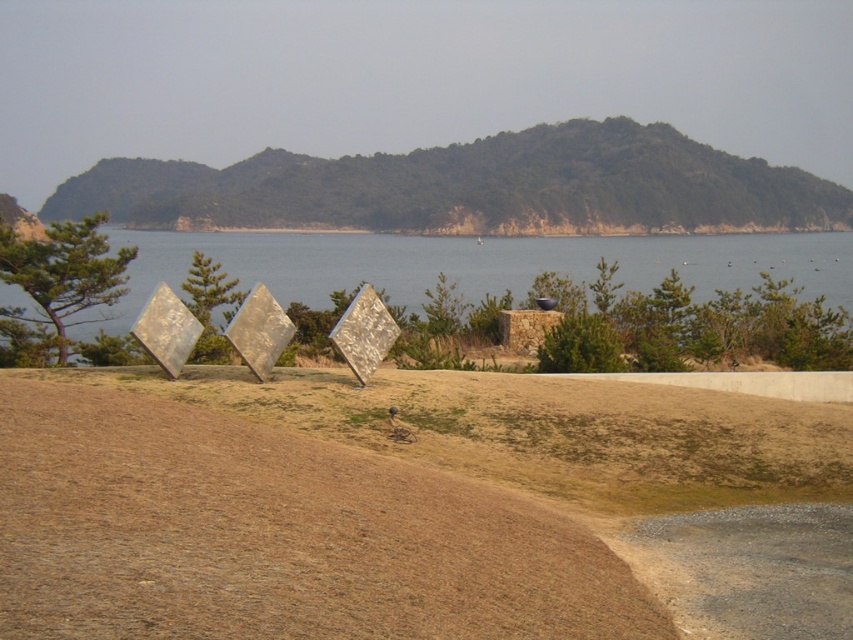
Is point (337, 216) closer to viewer compared to point (310, 276)?

That is False.

How far apart are green textured hillside at upper center and blue water at center?

green textured hillside at upper center is 23.48 meters away from blue water at center.

Which is behind, point (219, 202) or point (341, 237)?

The point (341, 237) is more distant.

Where is `green textured hillside at upper center`? The image size is (853, 640). green textured hillside at upper center is located at coordinates (473, 188).